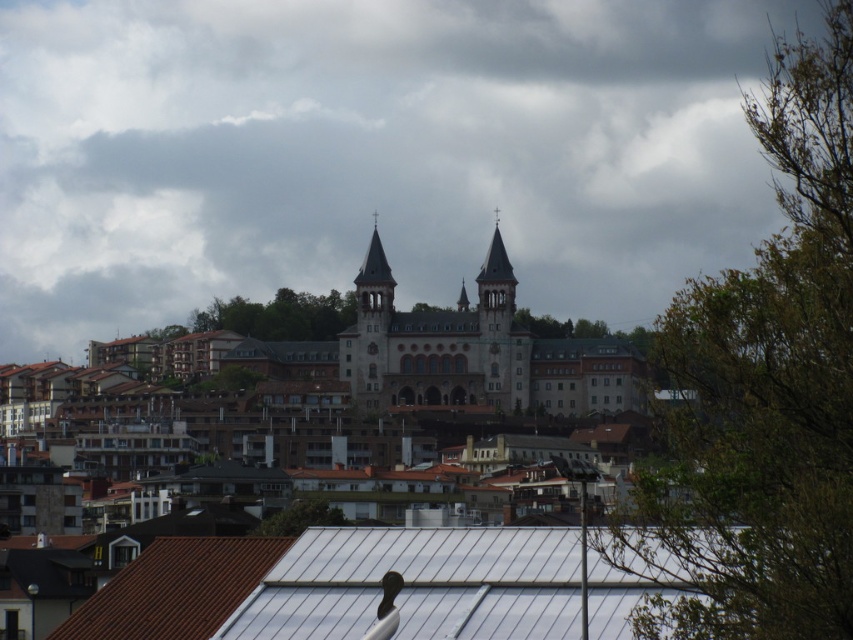
Question: Among these objects, which one is nearest to the camera?

Choices:
 (A) white metal roof at lower center
 (B) dark gray stone church at center

Answer: (A)

Question: Which point is farther to the camera?

Choices:
 (A) brown corrugated roof at lower left
 (B) white metal roof at lower center
 (C) brown stone tower at center
 (D) dark gray stone church at center

Answer: (C)

Question: Can you confirm if dark gray stone church at center is positioned to the left of brown corrugated roof at lower left?

Choices:
 (A) yes
 (B) no

Answer: (B)

Question: Does brown stone tower at center have a larger size compared to smooth stone spire at center?

Choices:
 (A) no
 (B) yes

Answer: (B)

Question: Does dark gray stone church at center come in front of smooth stone spire at center?

Choices:
 (A) no
 (B) yes

Answer: (B)

Question: Which object is farther from the camera taking this photo?

Choices:
 (A) smooth stone spire at center
 (B) white metal roof at lower center
 (C) brown corrugated roof at lower left

Answer: (A)